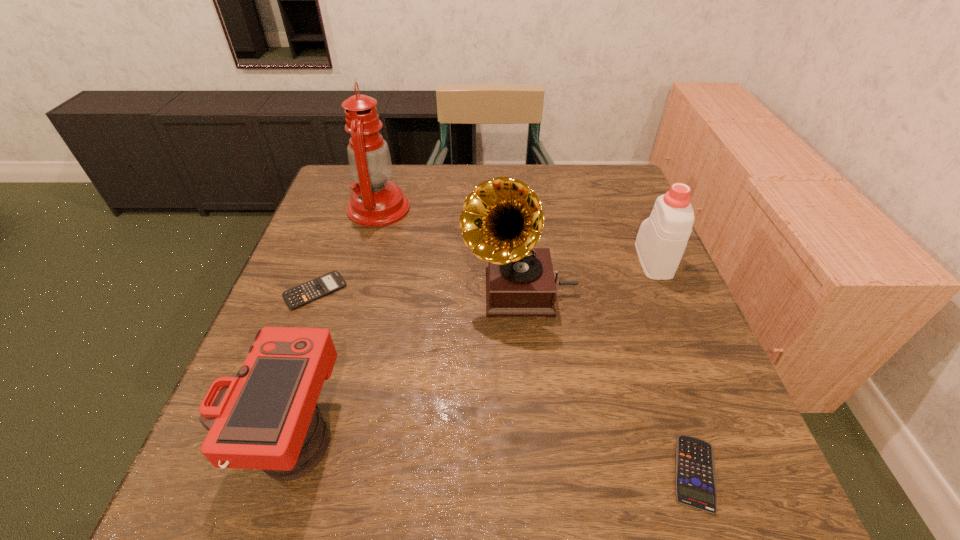
At what (x,y) coordinates should I click in order to perform the action: click on free space between the farther calculator and the fifth shortest object. Please return your answer as a coordinate pair (x, y). The width and height of the screenshot is (960, 540). Looking at the image, I should click on (418, 291).

This screenshot has width=960, height=540. I want to click on vacant region between the fourth shortest object and the farther calculator, so click(x=484, y=275).

Locate an element on the screen. vacant space in between the detergent and the farther calculator is located at coordinates (484, 275).

Where is `vacant area that lies between the farther calculator and the tallest object`? vacant area that lies between the farther calculator and the tallest object is located at coordinates (347, 249).

Select which object is the third closest to the detergent. Please provide its 2D coordinates. Your answer should be formatted as a tuple, i.e. [(x, y)], where the tuple contains the x and y coordinates of a point satisfying the conditions above.

[(376, 202)]

At what (x,y) coordinates should I click in order to perform the action: click on object that is the fourth closest one to the farther calculator. Please return your answer as a coordinate pair (x, y). Image resolution: width=960 pixels, height=540 pixels. Looking at the image, I should click on (695, 473).

Locate an element on the screen. This screenshot has width=960, height=540. vacant space that satisfies the following two spatial constraints: 1. from the horn of the third object from right to left; 2. on the right side of the nearer calculator is located at coordinates (536, 473).